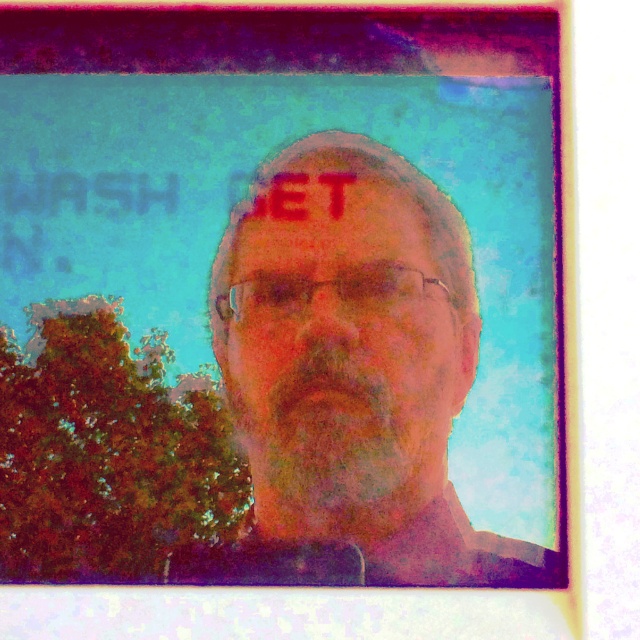
You are a photographer trying to position a subject in a portrait. The subject is wearing glasses and has a matte black face at center. According to the rule of thirds, where should the subject be placed to make the composition more dynamic? Please answer with coordinates in the format of a decimal number between 0 and 1 for both x and y axes.

According to the rule of thirds, the subject with the matte black face at center should be placed at either the top left, top right, bottom left, or bottom right intersection points. The coordinates for these points are approximately x and y values of 0.33 or 0.66. Since the current position is at approximately (x=349, y=376), moving it closer to 0.66 on the x and y axes would align better with the rule of thirds for a more dynamic composition.

Looking at the Polaroid photo, which object is taller between the matte skin face at center and the matte skin at center?

The matte skin face at center is much taller than the matte skin at center.

You are a photographer trying to adjust the lighting for a portrait. You notice a point at coordinates point [349,376] which marks the matte black face at center. Based on the scene description, what part of the subject should you focus on to ensure proper exposure?

The point [349,376] indicates the matte black face at center, so you should focus on the matte black face at center to ensure proper exposure.